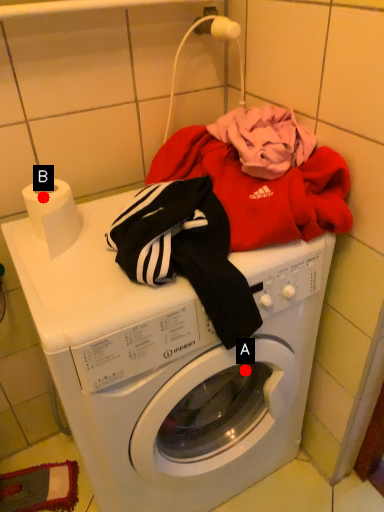
Question: Two points are circled on the image, labeled by A and B beside each circle. Among these points, which one is farthest from the camera?

Choices:
 (A) A is further
 (B) B is further

Answer: (A)